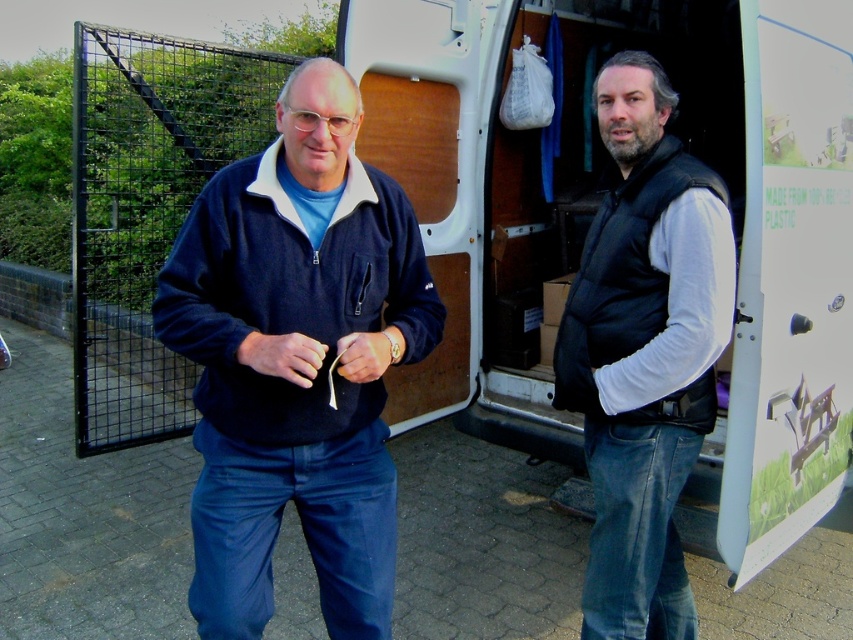
Question: Among these objects, which one is farthest from the camera?

Choices:
 (A) black matte vest at center
 (B) navy fleece jacket at center

Answer: (A)

Question: Can you confirm if navy fleece jacket at center is positioned below black matte vest at center?

Choices:
 (A) yes
 (B) no

Answer: (A)

Question: Which object is farther from the camera taking this photo?

Choices:
 (A) black matte vest at center
 (B) navy fleece jacket at center

Answer: (A)

Question: Does white plastic van at center appear over navy fleece jacket at center?

Choices:
 (A) no
 (B) yes

Answer: (B)

Question: Which object appears closest to the camera in this image?

Choices:
 (A) white plastic van at center
 (B) navy fleece jacket at center
 (C) black matte vest at center

Answer: (B)

Question: Is navy fleece jacket at center smaller than black matte vest at center?

Choices:
 (A) no
 (B) yes

Answer: (A)